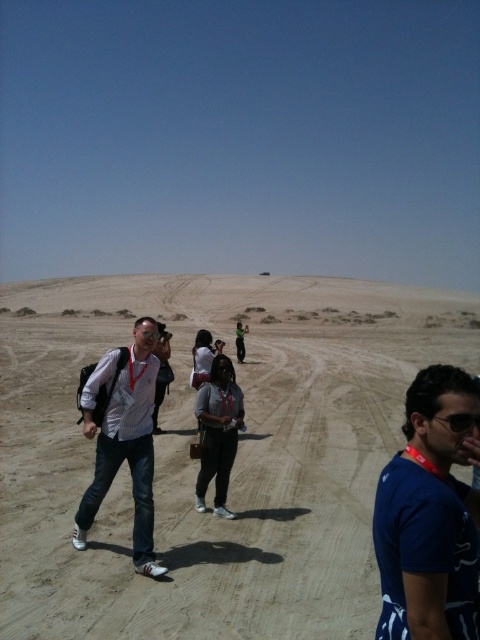
Question: From the image, what is the correct spatial relationship of brown sandy dirt track at center in relation to green fabric shirt at center?

Choices:
 (A) below
 (B) above

Answer: (B)

Question: Can you confirm if blue fabric shirt at center is positioned above matte gray shirt at center?

Choices:
 (A) no
 (B) yes

Answer: (B)

Question: Where is brown sandy dirt track at center located in relation to green fabric shirt at center in the image?

Choices:
 (A) below
 (B) above

Answer: (B)

Question: Among these points, which one is farthest from the camera?

Choices:
 (A) (470, 419)
 (B) (463, 586)
 (C) (194, 403)

Answer: (C)

Question: Considering the real-world distances, which object is closest to the green fabric shirt at center?

Choices:
 (A) brown sandy dirt track at center
 (B) matte gray shirt at center

Answer: (B)

Question: Among these objects, which one is nearest to the camera?

Choices:
 (A) matte gray shirt at center
 (B) green fabric shirt at center

Answer: (A)